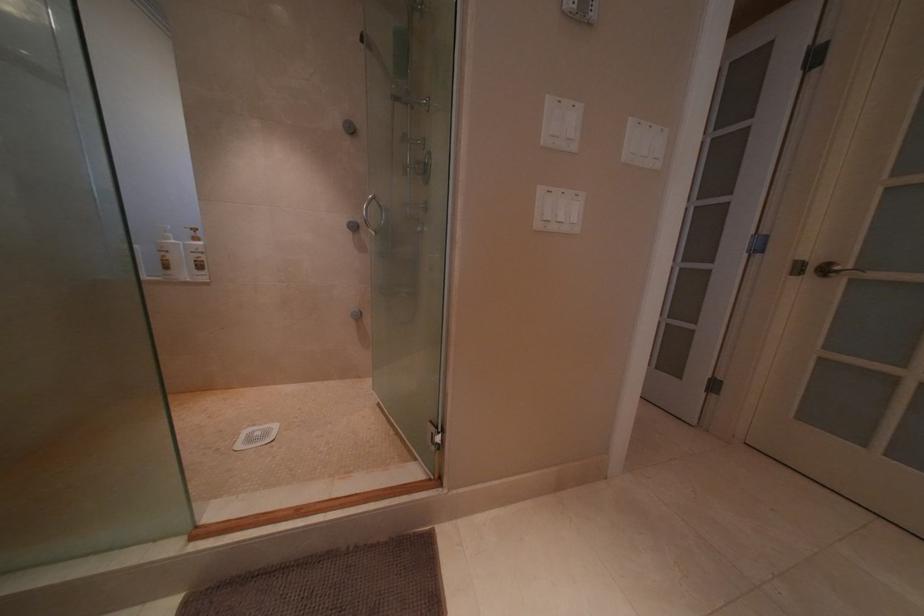
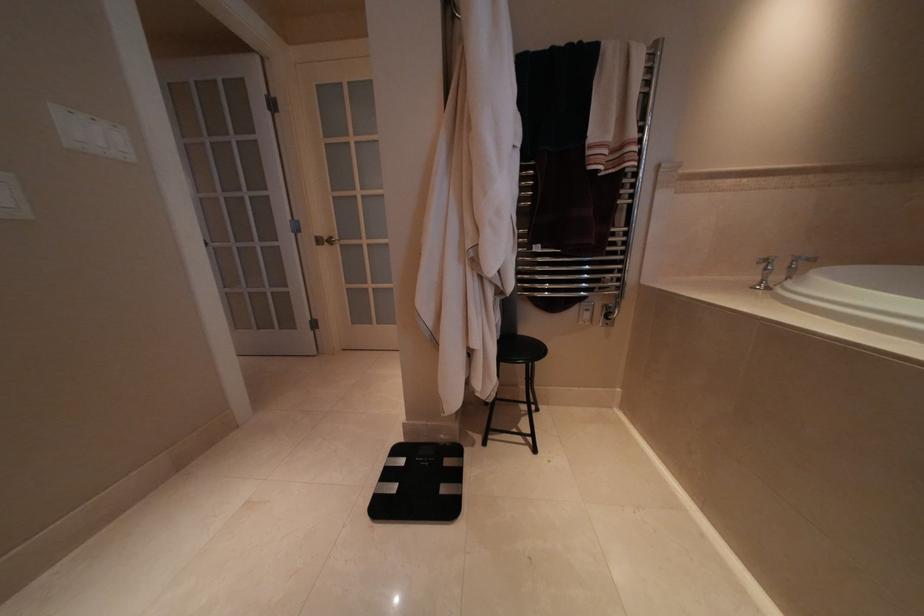
Question: The images are taken continuously from a first-person perspective. In which direction is your viewpoint rotating?

Choices:
 (A) Left
 (B) Right
 (C) Up
 (D) Down

Answer: (B)